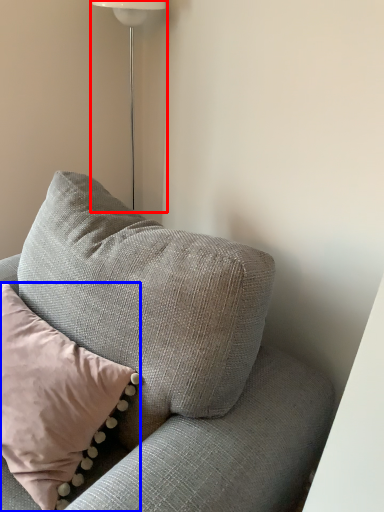
Question: Which object is closer to the camera taking this photo, lamp (highlighted by a red box) or pillow (highlighted by a blue box)?

Choices:
 (A) lamp
 (B) pillow

Answer: (B)